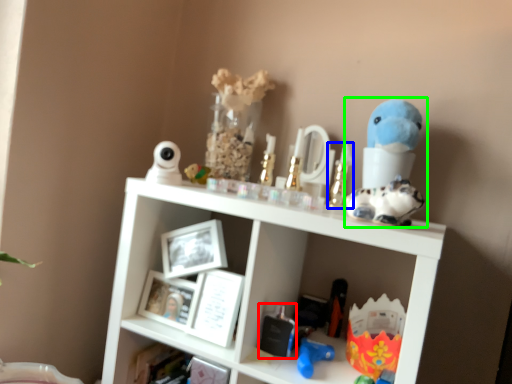
Question: Which object is the farthest from toy (highlighted by a red box)? Choose among these: toy (highlighted by a blue box) or figurine (highlighted by a green box).

Choices:
 (A) toy
 (B) figurine

Answer: (B)